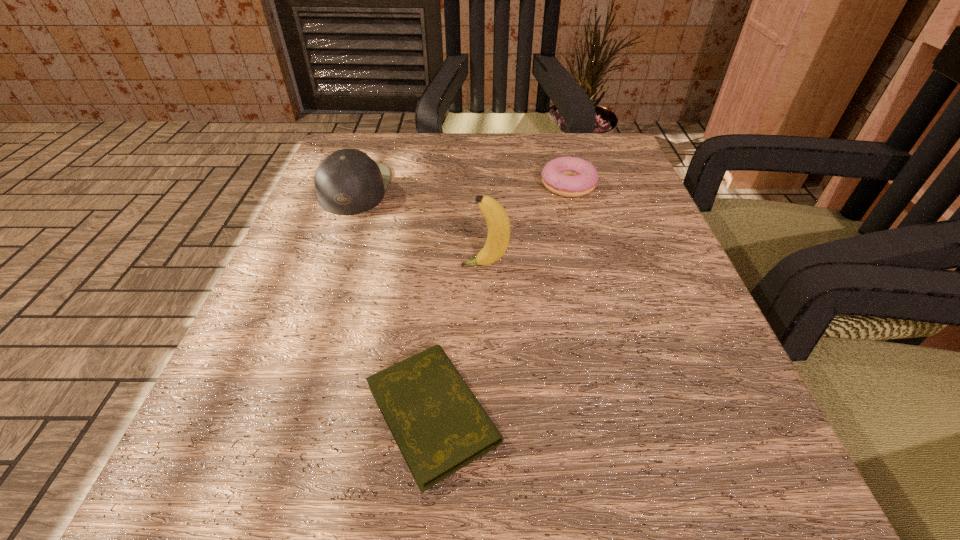
Find the location of a particular element. banana is located at coordinates (497, 219).

Locate an element on the screen. the second nearest object is located at coordinates (497, 219).

I want to click on the leftmost object, so click(x=348, y=182).

The height and width of the screenshot is (540, 960). I want to click on the second tallest object, so click(x=348, y=182).

Identify the location of the third tallest object. This screenshot has height=540, width=960. click(567, 176).

Where is `the rightmost object`? the rightmost object is located at coordinates pos(567,176).

Where is `diary`? diary is located at coordinates (440, 427).

The width and height of the screenshot is (960, 540). What are the coordinates of `the shortest object` in the screenshot? It's located at (440, 427).

The image size is (960, 540). What are the coordinates of `vacant region located 0.270m from the stem of the third farthest object` in the screenshot? It's located at (293, 265).

This screenshot has width=960, height=540. I want to click on free region located 0.160m from the stem of the third farthest object, so click(x=361, y=265).